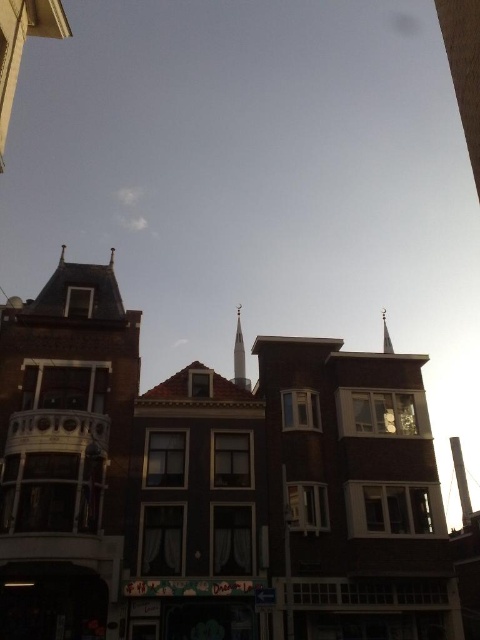
Is smooth silver spire at right bigger than silver metallic spire at upper center?

Yes, smooth silver spire at right is bigger than silver metallic spire at upper center.

Describe the element at coordinates (460, 481) in the screenshot. This screenshot has height=640, width=480. I see `smooth silver spire at right` at that location.

At what (x,y) coordinates should I click in order to perform the action: click on smooth silver spire at right. Please return your answer as a coordinate pair (x, y). This screenshot has height=640, width=480. Looking at the image, I should click on (460, 481).

Who is more distant from viewer, (74, 508) or (235, 380)?

The point (235, 380) is more distant.

Can you confirm if brick tower at left is positioned above white glossy spire at center?

Incorrect, brick tower at left is not positioned above white glossy spire at center.

Is point (84, 321) farther from viewer compared to point (237, 374)?

That is False.

At what (x,y) coordinates should I click in order to perform the action: click on brick tower at left. Please return your answer as a coordinate pair (x, y). Looking at the image, I should click on pos(64,452).

Which is below, brick tower at left or smooth silver spire at right?

smooth silver spire at right is lower down.

Who is more distant from viewer, (x=16, y=445) or (x=454, y=436)?

The point (x=454, y=436) is behind.

This screenshot has width=480, height=640. Identify the location of brick tower at left. (64, 452).